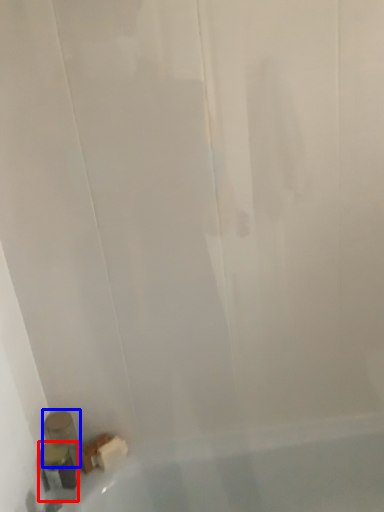
Question: Which of the following is the farthest to the observer, toiletry (highlighted by a red box) or toiletry (highlighted by a blue box)?

Choices:
 (A) toiletry
 (B) toiletry

Answer: (B)